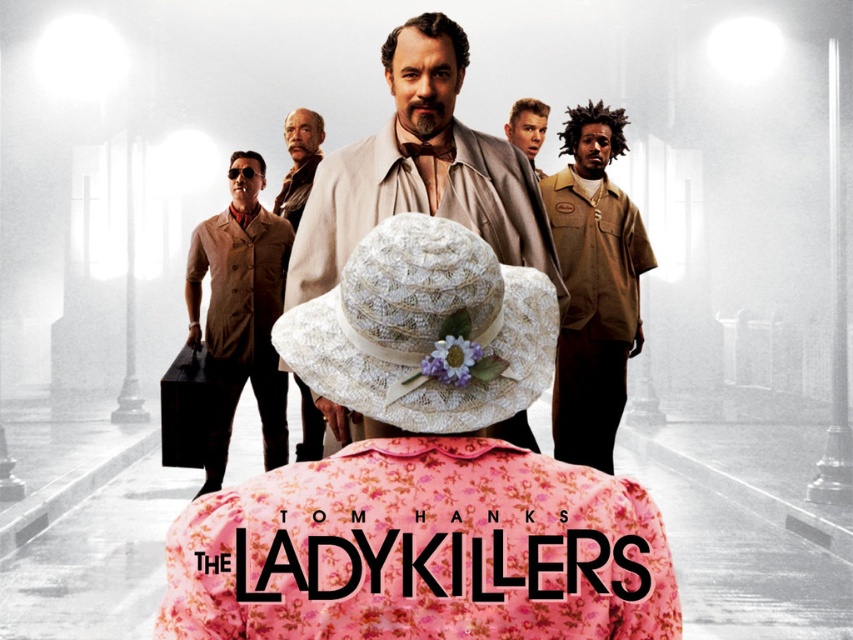
Based on the scene description, where is the smooth brown suit at center located in terms of its 2D coordinates?

The smooth brown suit at center is located at the 2D coordinates point [299,163].

You are a costume designer reviewing the promotional poster for the film. You need to choose between the smooth brown suit at center and the brown leather jacket at center for the main character. Based on their sizes, which one would be more suitable for a character who needs to move freely in action scenes?

The smooth brown suit at center has a smaller size compared to the brown leather jacket at center, making it more suitable for action scenes requiring mobility.

You are a film director analyzing the poster for spatial composition. You notice two points marked on the image. Which of the two points, point (310, 428) or point (293, 147), is positioned further away from the viewer?

Point (310, 428) is positioned further away from the viewer than point (293, 147).